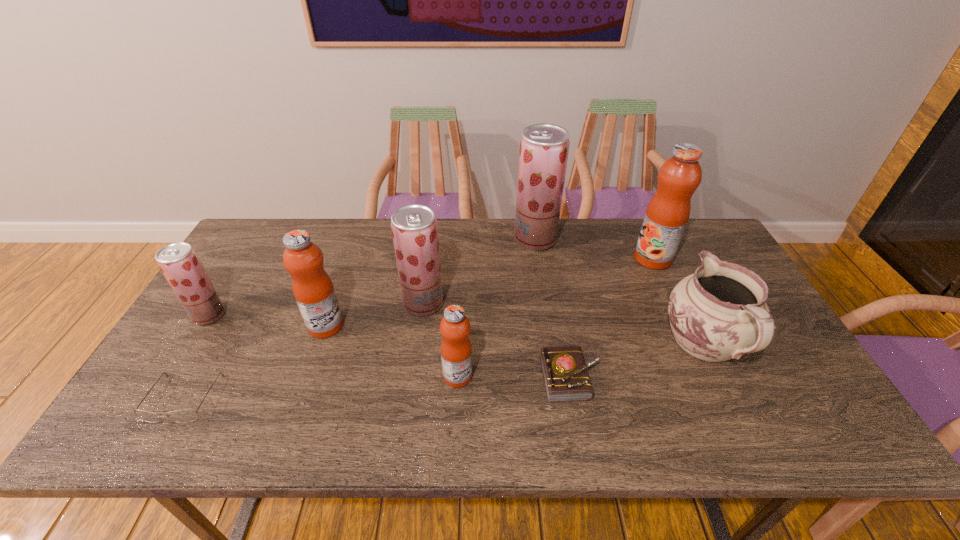
Where is `free space located on the front label of the second biggest orange fruit juice`? This screenshot has width=960, height=540. free space located on the front label of the second biggest orange fruit juice is located at coordinates (436, 326).

Identify the location of free region located on the right of the leftmost fruit juice. Image resolution: width=960 pixels, height=540 pixels. [243, 315].

Image resolution: width=960 pixels, height=540 pixels. Identify the location of vacant space situated on the front label of the smallest orange fruit juice. (526, 376).

Identify the location of vacant space located 0.140m on the spout of the pitcher. The image size is (960, 540). coord(670,274).

This screenshot has height=540, width=960. What are the coordinates of `vacant region located on the spout of the pitcher` in the screenshot? It's located at (675, 283).

You are a GUI agent. You are given a task and a screenshot of the screen. Output one action in this format:
    pyautogui.click(x=<x>, y=<y>)
    Task: Click on the vacant region located on the spout of the pitcher
    The width and height of the screenshot is (960, 540).
    Given the screenshot: What is the action you would take?
    pyautogui.click(x=650, y=231)

You are a GUI agent. You are given a task and a screenshot of the screen. Output one action in this format:
    pyautogui.click(x=<x>, y=<y>)
    Task: Click on the free space located on the left of the diary
    The height and width of the screenshot is (540, 960).
    Given the screenshot: What is the action you would take?
    pyautogui.click(x=394, y=377)

You are a GUI agent. You are given a task and a screenshot of the screen. Output one action in this format:
    pyautogui.click(x=<x>, y=<y>)
    Task: Click on the object that is at the near edge
    The height and width of the screenshot is (540, 960).
    Given the screenshot: What is the action you would take?
    pyautogui.click(x=181, y=416)

Locate an element on the screen. fruit juice positioned at the left edge is located at coordinates (179, 263).

Where is `spectacles that is positioned at the left edge`? The image size is (960, 540). spectacles that is positioned at the left edge is located at coordinates (181, 416).